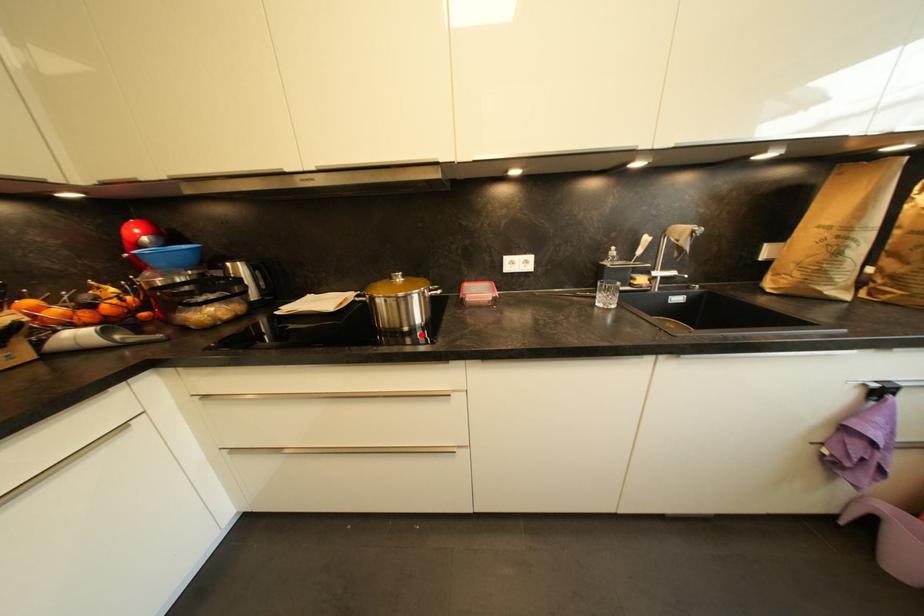
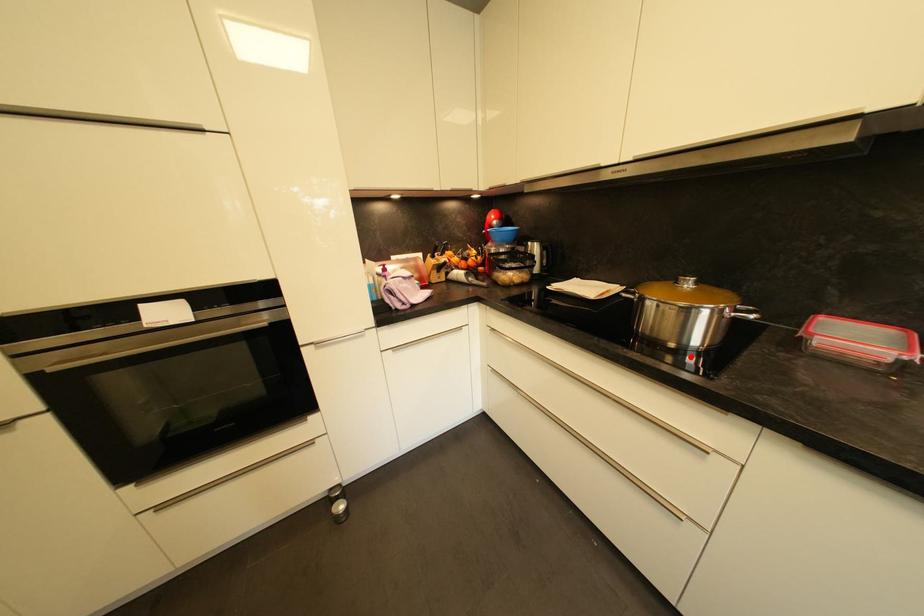
I am providing you with two images of the same scene from different viewpoints. A red point is marked on the first image and another point is marked on the second image. Does the point marked in image1 correspond to the same location as the one in image2?

Yes